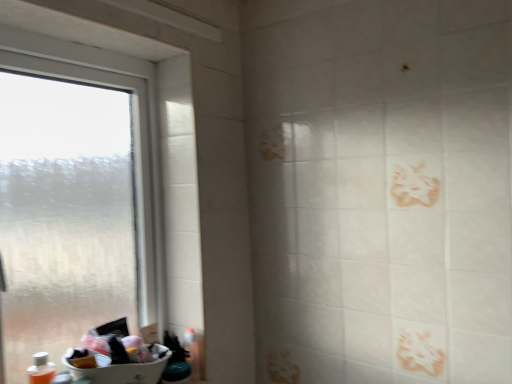
Question: Does white plastic sink at lower left have a smaller size compared to transparent frosted glass window at left?

Choices:
 (A) no
 (B) yes

Answer: (B)

Question: Does white plastic sink at lower left contain transparent frosted glass window at left?

Choices:
 (A) yes
 (B) no

Answer: (B)

Question: Is white plastic sink at lower left wider than transparent frosted glass window at left?

Choices:
 (A) yes
 (B) no

Answer: (A)

Question: Is the surface of white plastic sink at lower left in direct contact with transparent frosted glass window at left?

Choices:
 (A) yes
 (B) no

Answer: (B)

Question: From a real-world perspective, is white plastic sink at lower left located beneath transparent frosted glass window at left?

Choices:
 (A) yes
 (B) no

Answer: (A)

Question: Is white plastic sink at lower left situated inside transparent frosted glass window at left or outside?

Choices:
 (A) inside
 (B) outside

Answer: (A)

Question: Relative to transparent frosted glass window at left, is white plastic sink at lower left in front or behind?

Choices:
 (A) front
 (B) behind

Answer: (B)

Question: Considering the positions of point (124, 359) and point (27, 360), is point (124, 359) closer or farther from the camera than point (27, 360)?

Choices:
 (A) closer
 (B) farther

Answer: (B)

Question: Is white plastic sink at lower left bigger or smaller than transparent frosted glass window at left?

Choices:
 (A) small
 (B) big

Answer: (A)

Question: In the image, is translucent plastic bottle at lower left positioned in front of or behind transparent frosted glass window at left?

Choices:
 (A) front
 (B) behind

Answer: (B)

Question: Looking at the image, does translucent plastic bottle at lower left seem bigger or smaller compared to transparent frosted glass window at left?

Choices:
 (A) small
 (B) big

Answer: (A)

Question: From a real-world perspective, is translucent plastic bottle at lower left above or below transparent frosted glass window at left?

Choices:
 (A) below
 (B) above

Answer: (A)

Question: Based on their positions, is translucent plastic bottle at lower left located to the left or right of transparent frosted glass window at left?

Choices:
 (A) right
 (B) left

Answer: (B)

Question: Relative to white plastic sink at lower left, is transparent frosted glass window at left in front or behind?

Choices:
 (A) behind
 (B) front

Answer: (B)

Question: Is point (89, 124) positioned closer to the camera than point (116, 324)?

Choices:
 (A) closer
 (B) farther

Answer: (A)